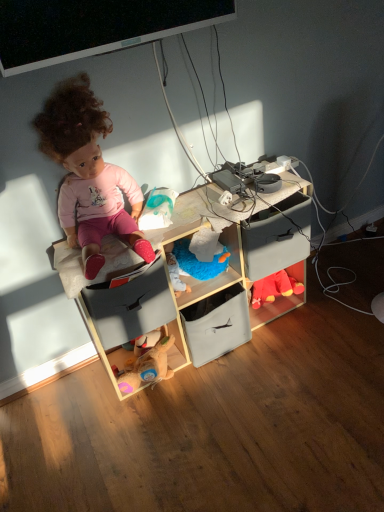
Find the location of `free spot to the right of matte plastic bag at center, marked as the 2th toy in a back-to-front arrangement`. free spot to the right of matte plastic bag at center, marked as the 2th toy in a back-to-front arrangement is located at coordinates coord(210,205).